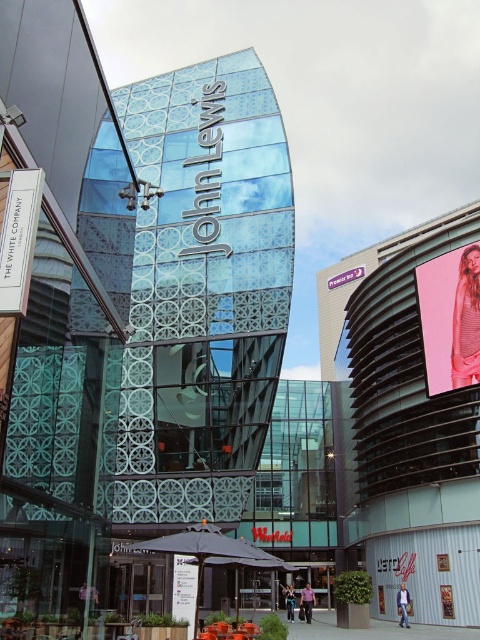
You are a delivery person trying to navigate to the entrance of the John Lewis building. You see the pink fabric billboard at upper right and the white paper sign at lower left. Which object is closer to you, and how does this help you locate the entrance?

The pink fabric billboard at upper right is closer to you than the white paper sign at lower left. Since it is closer, it might be positioned nearer to your current location, possibly indicating the direction towards the John Lewis building entrance.

You are a customer looking for the entrance to the John Lewis building. You see a white paper sign at lower left and a matte white sign at center. Which sign is closer to the left side of the entrance?

The white paper sign at lower left is positioned on the left side of matte white sign at center, so it is closer to the left side of the entrance.

Based on the photo, you are a delivery person standing at the white paper sign at lower left, and you need to deliver a package to the matte white sign at center. The delivery robot you use has a maximum range of 25 meters. Can the robot complete the delivery without needing a recharge?

The distance between the white paper sign at lower left and the matte white sign at center is 26.41 meters. Since the robot can only travel up to 25 meters, it cannot complete the delivery without needing a recharge.